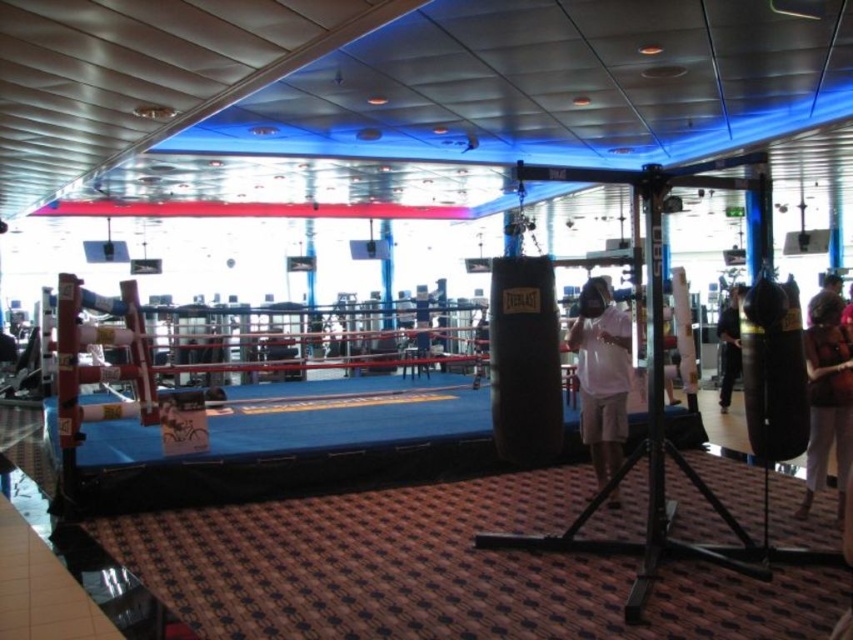
In the scene shown: Does white matte shirt at center have a lesser height compared to black fabric pants at lower right?

In fact, white matte shirt at center may be taller than black fabric pants at lower right.

Is point (577, 332) closer to viewer compared to point (727, 401)?

Yes, it is.

What do you see at coordinates (601, 376) in the screenshot?
I see `white matte shirt at center` at bounding box center [601, 376].

I want to click on white matte shirt at center, so click(x=601, y=376).

Does black fabric pants at lower right have a lesser width compared to brown leather jacket at upper right?

Correct, black fabric pants at lower right's width is less than brown leather jacket at upper right's.

Between point (718, 346) and point (837, 294), which one is positioned behind?

The point (718, 346) is behind.

Is point (724, 365) farther from camera compared to point (810, 298)?

Yes.

Locate an element on the screen. black fabric pants at lower right is located at coordinates (729, 342).

The image size is (853, 640). What are the coordinates of `dark brown leather jacket at lower right` in the screenshot? It's located at (827, 396).

Who is more distant from viewer, (x=827, y=416) or (x=726, y=410)?

The point (x=726, y=410) is more distant.

Where is `dark brown leather jacket at lower right`? The height and width of the screenshot is (640, 853). dark brown leather jacket at lower right is located at coordinates (827, 396).